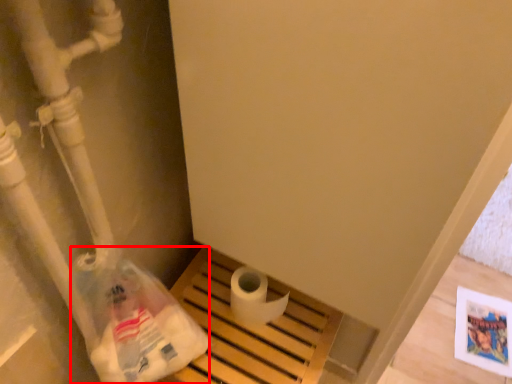
Question: From the image's perspective, what is the correct spatial positioning of paper bag (annotated by the red box) in reference to toilet paper?

Choices:
 (A) below
 (B) above

Answer: (A)